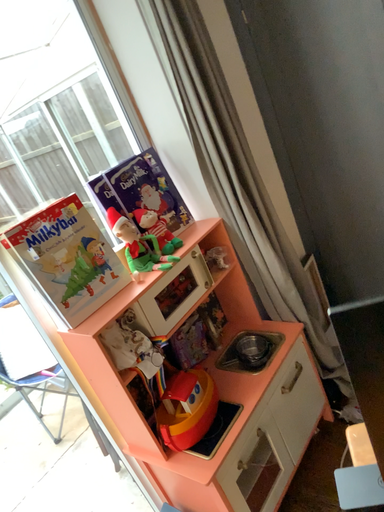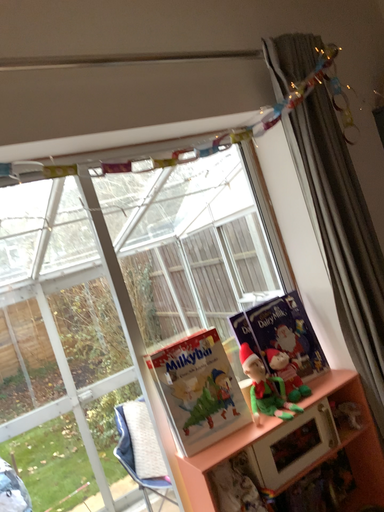
Question: How did the camera likely rotate when shooting the video?

Choices:
 (A) rotated downward
 (B) rotated upward

Answer: (B)